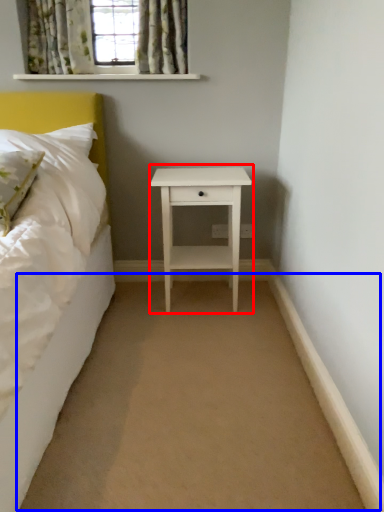
Question: Among these objects, which one is nearest to the camera, nightstand (highlighted by a red box) or plain (highlighted by a blue box)?

Choices:
 (A) nightstand
 (B) plain

Answer: (B)